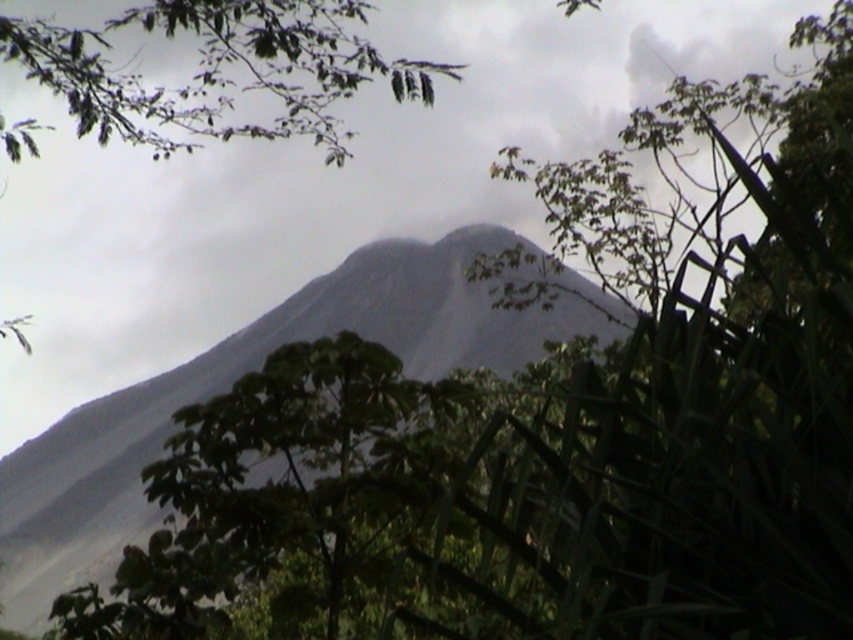
Question: Among these objects, which one is nearest to the camera?

Choices:
 (A) gray/rocky mountain at center
 (B) green leafy branch at upper left

Answer: (B)

Question: Does gray/rocky mountain at center come behind green leafy branch at upper left?

Choices:
 (A) no
 (B) yes

Answer: (B)

Question: Can you confirm if gray/rocky mountain at center is thinner than green leafy branch at upper left?

Choices:
 (A) yes
 (B) no

Answer: (B)

Question: Can you confirm if gray/rocky mountain at center is positioned below green leafy branch at upper left?

Choices:
 (A) yes
 (B) no

Answer: (A)